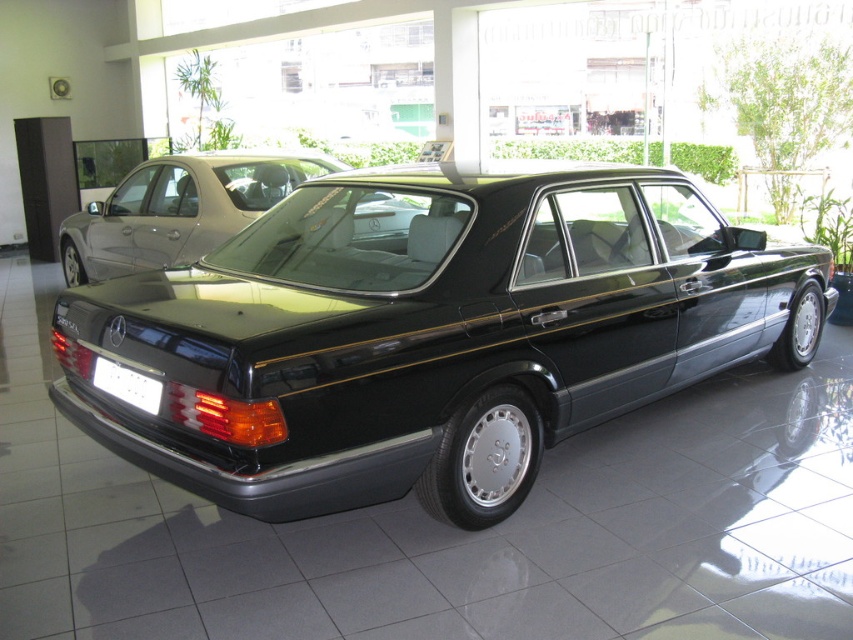
You are standing in a car showroom and see a point marked at coordinates (180, 209). What object is located at that point?

The point at coordinates (180, 209) indicates the glossy black sedan at center.

You are a delivery person needing to unload a package between the glossy black car at center and the glossy black sedan at center. The package requires 8 feet of space. Is there enough space between them to place the package?

The glossy black car at center and glossy black sedan at center are 10.00 feet apart from each other, so yes, there is enough space to place the package between them since 10 feet is greater than 8 feet.

You are a delivery person trying to deliver a package to the white plastic license plate at rear. The package can only be placed within 4 feet of the license plate. Can you safely place the package near the glossy black car at center?

The glossy black car at center is 4.62 feet away from the white plastic license plate at rear. Since the package must be within 4 feet, the distance is too far to safely place the package there.